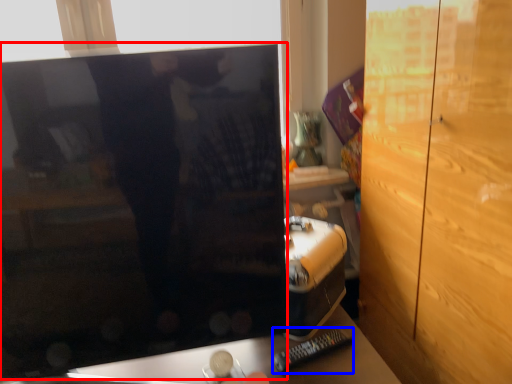
Question: Among these objects, which one is nearest to the camera, computer monitor (highlighted by a red box) or remote (highlighted by a blue box)?

Choices:
 (A) computer monitor
 (B) remote

Answer: (A)